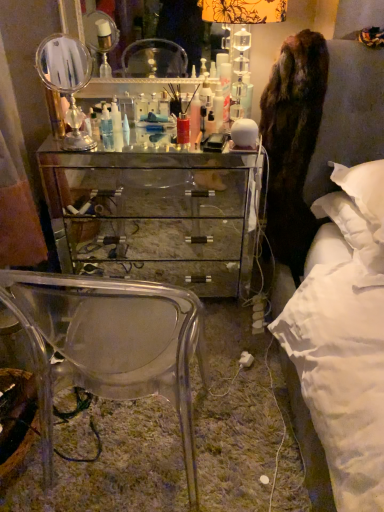
Question: Can you confirm if clear acrylic mirror at center, the 2th mirror when ordered from front to back, is positioned to the right of translucent plastic bottle at center, arranged as the third toiletry when viewed from the right?

Choices:
 (A) no
 (B) yes

Answer: (B)

Question: Can you confirm if clear acrylic mirror at center, the second mirror from the bottom, is positioned to the left of translucent plastic bottle at center, which ranks as the 1th toiletry in left-to-right order?

Choices:
 (A) yes
 (B) no

Answer: (B)

Question: Is clear acrylic mirror at center, the 2th mirror when ordered from front to back, positioned beyond the bounds of translucent plastic bottle at center, arranged as the third toiletry when viewed from the right?

Choices:
 (A) yes
 (B) no

Answer: (A)

Question: From the image's perspective, is clear acrylic mirror at center, the 2th mirror when ordered from front to back, below translucent plastic bottle at center, which ranks as the 1th toiletry in left-to-right order?

Choices:
 (A) yes
 (B) no

Answer: (B)

Question: Does clear acrylic mirror at center, the 2th mirror when ordered from front to back, have a greater width compared to translucent plastic bottle at center, which ranks as the 1th toiletry in left-to-right order?

Choices:
 (A) yes
 (B) no

Answer: (A)

Question: Considering the relative sizes of clear acrylic mirror at center, acting as the 1th mirror starting from the back, and translucent plastic bottle at center, arranged as the third toiletry when viewed from the right, in the image provided, is clear acrylic mirror at center, acting as the 1th mirror starting from the back, shorter than translucent plastic bottle at center, arranged as the third toiletry when viewed from the right,?

Choices:
 (A) no
 (B) yes

Answer: (A)

Question: From the image's perspective, is brown furry coat at right beneath translucent plastic bottle at center, which ranks as the 1th toiletry in left-to-right order?

Choices:
 (A) no
 (B) yes

Answer: (B)

Question: Is brown furry coat at right surrounding translucent plastic bottle at center, arranged as the third toiletry when viewed from the right?

Choices:
 (A) yes
 (B) no

Answer: (B)

Question: Does brown furry coat at right have a lesser height compared to translucent plastic bottle at center, which ranks as the 1th toiletry in left-to-right order?

Choices:
 (A) no
 (B) yes

Answer: (A)

Question: Is brown furry coat at right at the left side of translucent plastic bottle at center, which ranks as the 1th toiletry in left-to-right order?

Choices:
 (A) yes
 (B) no

Answer: (B)

Question: Is brown furry coat at right looking in the opposite direction of translucent plastic bottle at center, which ranks as the 1th toiletry in left-to-right order?

Choices:
 (A) yes
 (B) no

Answer: (B)

Question: From a real-world perspective, is brown furry coat at right positioned under translucent plastic bottle at center, which ranks as the 1th toiletry in left-to-right order, based on gravity?

Choices:
 (A) yes
 (B) no

Answer: (A)

Question: From a real-world perspective, does clear acrylic mirror at center, the 2th mirror when ordered from front to back, stand above mirrored glass chest of drawers at center?

Choices:
 (A) yes
 (B) no

Answer: (A)